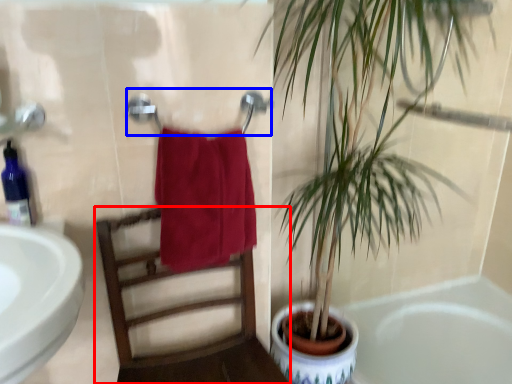
Question: Which of the following is the farthest to the observer, chair (highlighted by a red box) or towel bar (highlighted by a blue box)?

Choices:
 (A) chair
 (B) towel bar

Answer: (B)